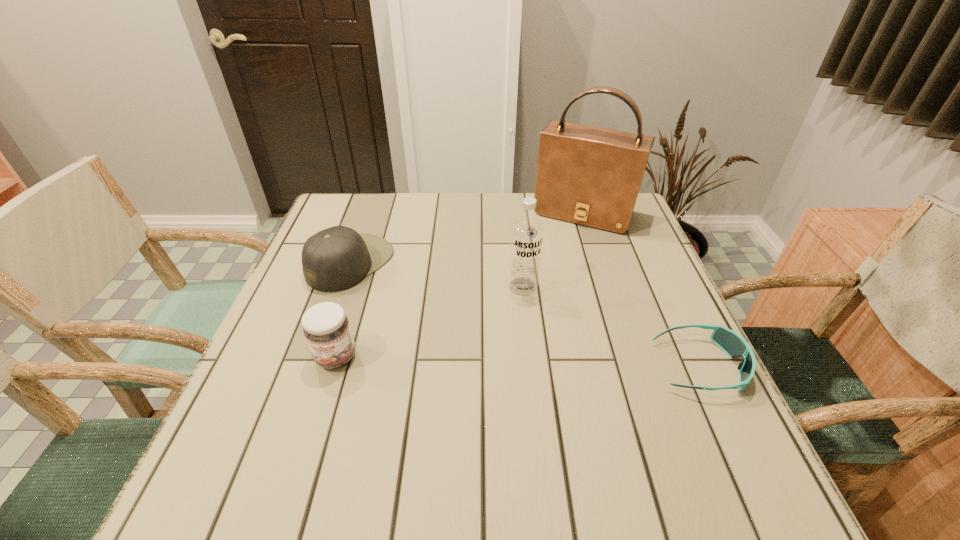
Locate an element on the screen. vacant area at the far right corner of the desktop is located at coordinates (628, 230).

I want to click on free space that is in between the shoulder bag and the third object from left to right, so click(x=553, y=250).

Locate an element on the screen. This screenshot has width=960, height=540. free spot between the jam and the shoulder bag is located at coordinates (460, 285).

Where is `empty space between the sunglasses and the cap`? empty space between the sunglasses and the cap is located at coordinates (525, 314).

The width and height of the screenshot is (960, 540). In order to click on free space between the sunglasses and the jam in this screenshot , I will do `click(518, 361)`.

At what (x,y) coordinates should I click in order to perform the action: click on free space that is in between the cap and the shortest object. Please return your answer as a coordinate pair (x, y). This screenshot has width=960, height=540. Looking at the image, I should click on (525, 314).

Locate an element on the screen. This screenshot has height=540, width=960. free space between the tallest object and the jam is located at coordinates (460, 285).

The height and width of the screenshot is (540, 960). Identify the location of free space between the cap and the shoulder bag. (468, 238).

Locate an element on the screen. The width and height of the screenshot is (960, 540). object that stands as the second closest to the second tallest object is located at coordinates (735, 346).

Image resolution: width=960 pixels, height=540 pixels. What are the coordinates of `object that can be found as the closest to the jam` in the screenshot? It's located at (337, 258).